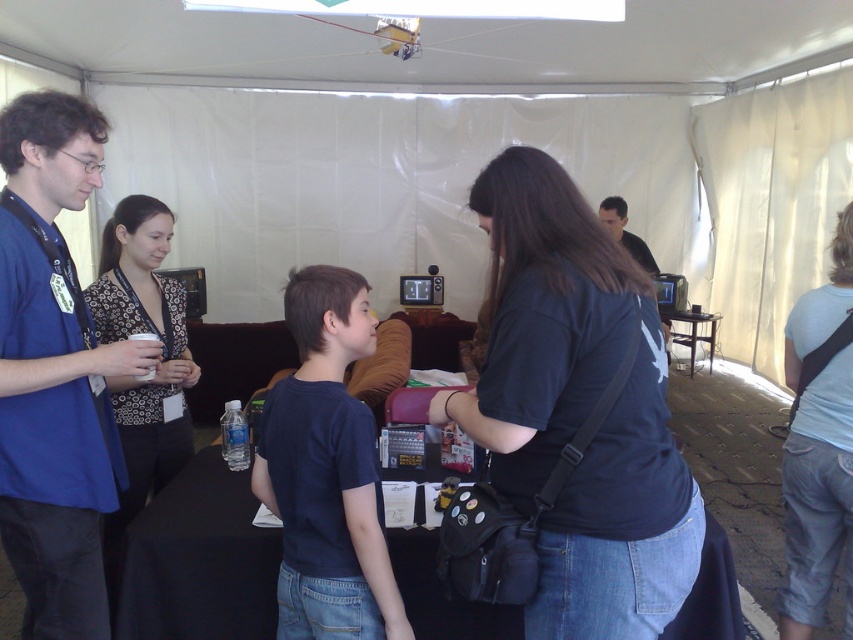
Question: Can you confirm if blue shirt at left is positioned to the left of black matte shirt at upper center?

Choices:
 (A) yes
 (B) no

Answer: (A)

Question: Which point appears closest to the camera in this image?

Choices:
 (A) (85, 410)
 (B) (624, 227)

Answer: (A)

Question: Which of the following is the farthest from the observer?

Choices:
 (A) patterned fabric blouse at left
 (B) black matte shirt at upper center

Answer: (B)

Question: In this image, where is light blue cotton shirt at right located relative to black matte shirt at upper center?

Choices:
 (A) above
 (B) below

Answer: (B)

Question: Among these objects, which one is farthest from the camera?

Choices:
 (A) patterned fabric blouse at left
 (B) blue shirt at left
 (C) black shirt at center
 (D) black matte shirt at upper center

Answer: (D)

Question: Can you confirm if patterned fabric blouse at left is thinner than black shirt at center?

Choices:
 (A) yes
 (B) no

Answer: (A)